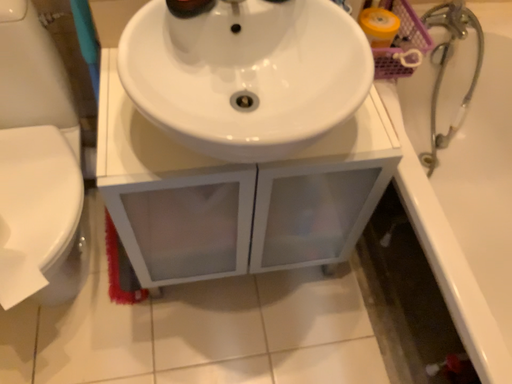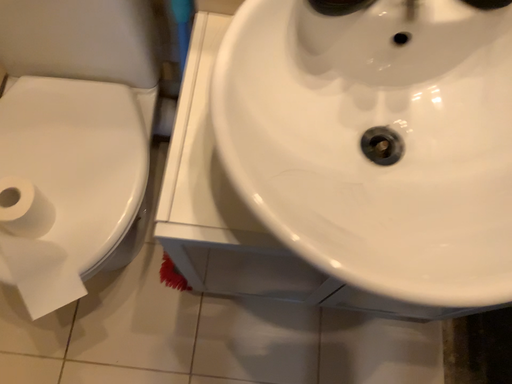
Question: Which way did the camera rotate in the video?

Choices:
 (A) rotated left
 (B) rotated right

Answer: (A)